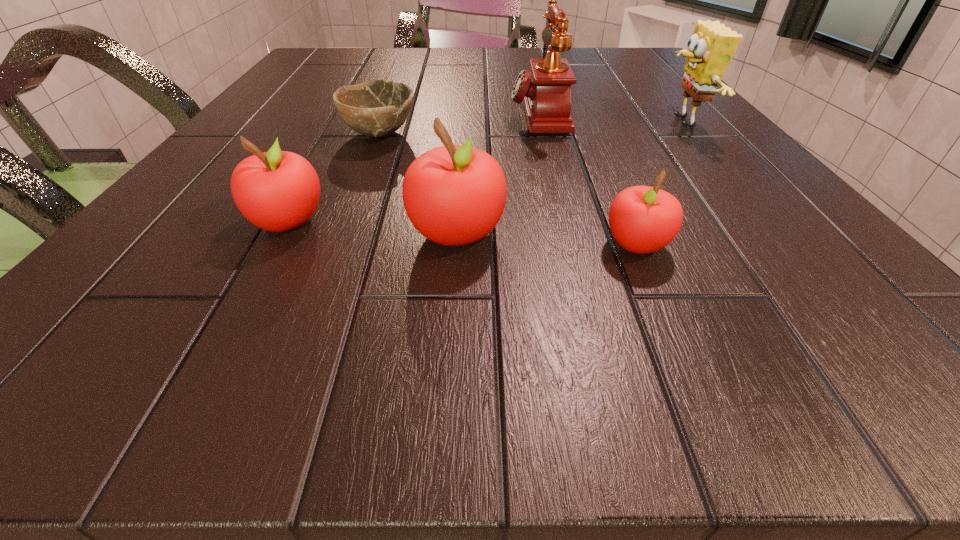
The width and height of the screenshot is (960, 540). I want to click on free region located 0.390m on the back of the second apple from left to right, so click(x=466, y=103).

Locate an element on the screen. The image size is (960, 540). free point located on the back of the shortest apple is located at coordinates (611, 184).

You are a GUI agent. You are given a task and a screenshot of the screen. Output one action in this format:
    pyautogui.click(x=<x>, y=<y>)
    Task: Click on the free spot located 0.160m on the left of the bowl
    
    Given the screenshot: What is the action you would take?
    pyautogui.click(x=253, y=134)

Where is `vacant space positioned 0.230m on the face of the sponge`? The height and width of the screenshot is (540, 960). vacant space positioned 0.230m on the face of the sponge is located at coordinates (542, 123).

Identify the location of vacant space located 0.270m on the face of the sponge. (521, 123).

Identify the location of vacant space situated on the face of the sponge. This screenshot has width=960, height=540. (547, 123).

Locate an element on the screen. vacant space located 0.140m on the dial of the telephone is located at coordinates (x=439, y=114).

This screenshot has height=540, width=960. I want to click on vacant space positioned on the dial of the telephone, so click(x=423, y=114).

This screenshot has height=540, width=960. I want to click on vacant space situated 0.240m on the dial of the telephone, so click(x=388, y=114).

Identify the location of object at the left edge. The height and width of the screenshot is (540, 960). (277, 191).